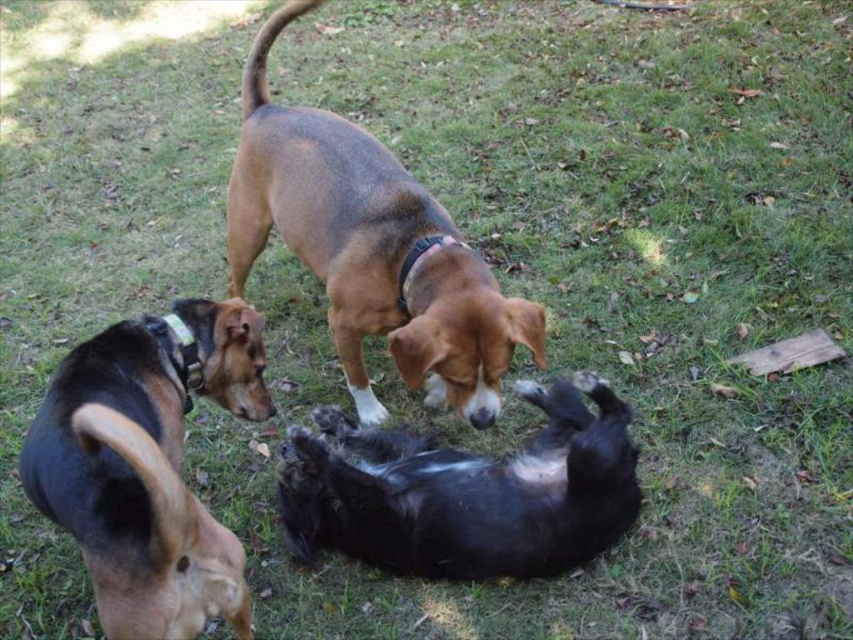
You are standing at the point with coordinates point (146, 314) and want to walk to the point with coordinates point (369, 410). Which direction should you move to reach your destination?

You should move forward because point (369, 410) is in front of point (146, 314).

You are standing at the position of the foreground dog and want to throw a ball to the middle dog. Is the distance between the black dog with a white patch on its chest and the brown matte dog at center within your throwing range of 2 meters?

The distance between the black dog with a white patch on its chest and the brown matte dog at center is 2.11 meters, which is slightly beyond your throwing range of 2 meters. You might need to throw a bit harder or move closer.

You are a photographer trying to capture a group photo of the brown matte dog at center and the black fur dog at center. To ensure both are in frame, should you adjust your camera to the left or right side?

The brown matte dog at center is to the left of the black fur dog at center, so you should adjust your camera to the right to ensure both are in frame.